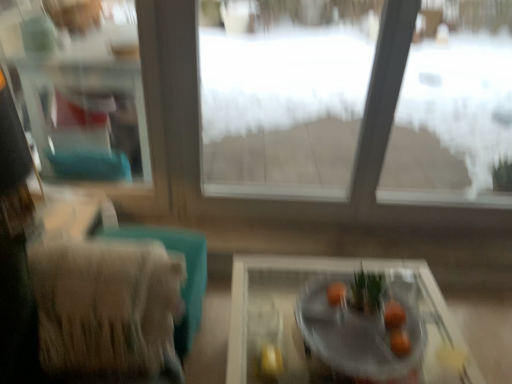
Locate an element on the screen. The width and height of the screenshot is (512, 384). free space to the back side of orange matte at center is located at coordinates (395, 299).